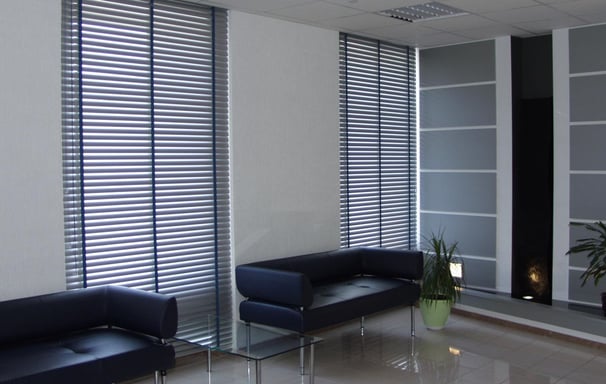
Locate an element on the screen. The width and height of the screenshot is (606, 384). plant leaves is located at coordinates (602, 250).